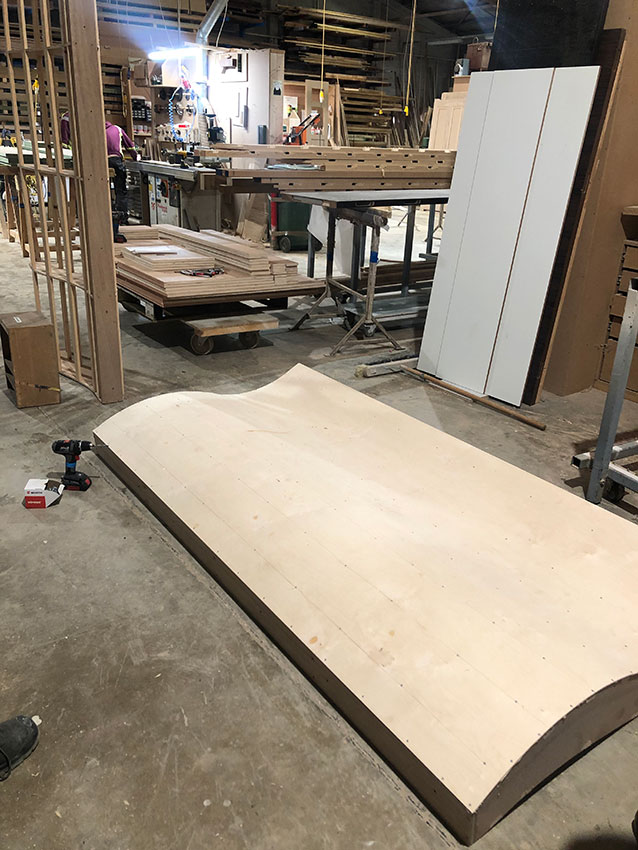
Find the location of a particular element. screws is located at coordinates (36, 494).